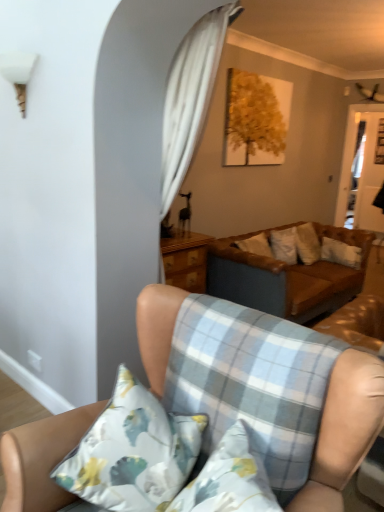
Question: Considering the relative positions of light blue plaid cushion at lower center and white plastic lampshade at upper left in the image provided, is light blue plaid cushion at lower center to the right of white plastic lampshade at upper left from the viewer's perspective?

Choices:
 (A) yes
 (B) no

Answer: (A)

Question: From a real-world perspective, is light blue plaid cushion at lower center positioned under white plastic lampshade at upper left based on gravity?

Choices:
 (A) no
 (B) yes

Answer: (B)

Question: Is there a large distance between light blue plaid cushion at lower center and white plastic lampshade at upper left?

Choices:
 (A) no
 (B) yes

Answer: (B)

Question: Is light blue plaid cushion at lower center smaller than white plastic lampshade at upper left?

Choices:
 (A) no
 (B) yes

Answer: (A)

Question: Is light blue plaid cushion at lower center closer to camera compared to white plastic lampshade at upper left?

Choices:
 (A) no
 (B) yes

Answer: (B)

Question: From the image's perspective, is light blue plaid cushion at lower center on white plastic lampshade at upper left?

Choices:
 (A) yes
 (B) no

Answer: (B)

Question: Can you confirm if brown leather couch at center, which is the 2th studio couch in front-to-back order, is shorter than light blue plaid cushion at lower center?

Choices:
 (A) yes
 (B) no

Answer: (B)

Question: From the image's perspective, would you say brown leather couch at center, which is the 2th studio couch in front-to-back order, is shown under light blue plaid cushion at lower center?

Choices:
 (A) yes
 (B) no

Answer: (B)

Question: From a real-world perspective, is brown leather couch at center, which is the 2th studio couch in front-to-back order, positioned under light blue plaid cushion at lower center based on gravity?

Choices:
 (A) yes
 (B) no

Answer: (A)

Question: Is brown leather couch at center, the first studio couch positioned from the back, surrounding light blue plaid cushion at lower center?

Choices:
 (A) yes
 (B) no

Answer: (B)

Question: Is brown leather couch at center, which is the 2th studio couch in front-to-back order, positioned beyond the bounds of light blue plaid cushion at lower center?

Choices:
 (A) yes
 (B) no

Answer: (A)

Question: Is brown leather couch at center, the first studio couch positioned from the back, turned away from light blue plaid cushion at lower center?

Choices:
 (A) yes
 (B) no

Answer: (B)

Question: Is floral fabric pillow at lower left beside light blue plaid cushion at lower center?

Choices:
 (A) yes
 (B) no

Answer: (B)